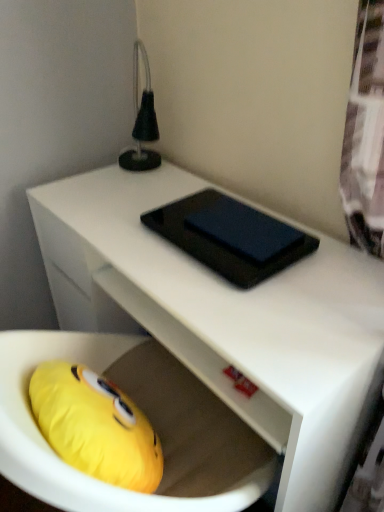
The width and height of the screenshot is (384, 512). I want to click on black glossy tablet at center, so click(x=230, y=237).

The width and height of the screenshot is (384, 512). Describe the element at coordinates (230, 237) in the screenshot. I see `black glossy tablet at center` at that location.

What do you see at coordinates (226, 319) in the screenshot?
I see `white matte desk at center` at bounding box center [226, 319].

Find the location of a particular element. The width and height of the screenshot is (384, 512). white matte desk at center is located at coordinates (226, 319).

Locate an element on the screen. The image size is (384, 512). black glossy tablet at center is located at coordinates (230, 237).

Between black glossy tablet at center and white matte desk at center, which one appears on the left side from the viewer's perspective?

Positioned to the left is white matte desk at center.

Does black glossy tablet at center lie behind white matte desk at center?

Yes, it is.

Is point (267, 274) positioned before point (48, 231)?

Yes, point (267, 274) is closer to viewer.

From the image's perspective, is black glossy tablet at center over white matte desk at center?

Yes, from the image's perspective, black glossy tablet at center is above white matte desk at center.

From a real-world perspective, relative to white matte desk at center, is black glossy tablet at center vertically above or below?

black glossy tablet at center is situated higher than white matte desk at center in the real world.

Which object is thinner, black glossy tablet at center or white matte desk at center?

With smaller width is black glossy tablet at center.

Who is taller, black glossy tablet at center or white matte desk at center?

Standing taller between the two is white matte desk at center.

Is black glossy tablet at center bigger than white matte desk at center?

Incorrect, black glossy tablet at center is not larger than white matte desk at center.

Is white matte desk at center inside black glossy tablet at center?

No, white matte desk at center is not inside black glossy tablet at center.

Is black glossy tablet at center beside white matte desk at center?

No, black glossy tablet at center is not making contact with white matte desk at center.

Could you tell me if black glossy tablet at center is turned towards white matte desk at center?

No, black glossy tablet at center is not facing towards white matte desk at center.

Measure the distance from black glossy tablet at center to white matte desk at center.

black glossy tablet at center and white matte desk at center are 6.22 inches apart.

This screenshot has height=512, width=384. I want to click on desk below the black glossy tablet at center (from the image's perspective), so click(226, 319).

Is white matte desk at center to the left of black glossy tablet at center from the viewer's perspective?

Correct, you'll find white matte desk at center to the left of black glossy tablet at center.

Considering the relative positions of white matte desk at center and black glossy tablet at center in the image provided, is white matte desk at center behind black glossy tablet at center?

No.

Looking at this image, which is nearer, [323,398] or [191,237]?

The point [323,398] is more forward.

From the image's perspective, is white matte desk at center positioned above or below black glossy tablet at center?

Based on their image positions, white matte desk at center is located beneath black glossy tablet at center.

From a real-world perspective, is white matte desk at center over black glossy tablet at center?

No, from a real-world perspective, white matte desk at center is not on top of black glossy tablet at center.

Considering the relative sizes of white matte desk at center and black glossy tablet at center in the image provided, is white matte desk at center wider than black glossy tablet at center?

Correct, the width of white matte desk at center exceeds that of black glossy tablet at center.

Between white matte desk at center and black glossy tablet at center, which one has more height?

Standing taller between the two is white matte desk at center.

Does white matte desk at center have a smaller size compared to black glossy tablet at center?

Actually, white matte desk at center might be larger than black glossy tablet at center.

Could black glossy tablet at center be considered to be inside white matte desk at center?

No, black glossy tablet at center is located outside of white matte desk at center.

Is white matte desk at center far from black glossy tablet at center?

Actually, white matte desk at center and black glossy tablet at center are a little close together.

Looking at this image, is white matte desk at center positioned with its back to black glossy tablet at center?

No, white matte desk at center is not facing away from black glossy tablet at center.

Can you tell me how much white matte desk at center and black glossy tablet at center differ in facing direction?

There is a 0.15-degree angle between the facing directions of white matte desk at center and black glossy tablet at center.

How far apart are white matte desk at center and black glossy tablet at center?

white matte desk at center is 6.22 inches away from black glossy tablet at center.

Locate an element on the screen. This screenshot has height=512, width=384. desk located in front of the black glossy tablet at center is located at coordinates (226, 319).

Locate an element on the screen. desk that is under the black glossy tablet at center (from a real-world perspective) is located at coordinates (226, 319).

Where is `pad positioned vertically above the white matte desk at center (from a real-world perspective)`? The image size is (384, 512). pad positioned vertically above the white matte desk at center (from a real-world perspective) is located at coordinates (230, 237).